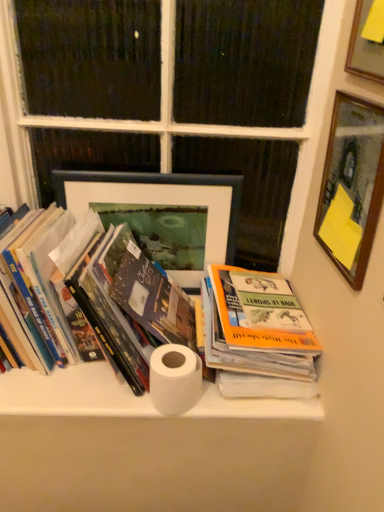
Question: Considering the relative positions of white matte toilet paper at center and hardcover book at left, which ranks as the first book in left-to-right order, in the image provided, is white matte toilet paper at center to the left or to the right of hardcover book at left, which ranks as the first book in left-to-right order,?

Choices:
 (A) left
 (B) right

Answer: (B)

Question: Does point (158, 378) appear closer or farther from the camera than point (127, 346)?

Choices:
 (A) farther
 (B) closer

Answer: (B)

Question: Which of these objects is positioned closest to the matte black picture frame at center, the first picture frame in the left-to-right sequence?

Choices:
 (A) wooden picture frame at upper right, acting as the second picture frame starting from the right
 (B) white painted wood at upper center
 (C) orange matte book at center, the first book positioned from the right
 (D) white paper towel at center
 (E) hardcover book at left, the second book from the right

Answer: (B)

Question: Which object is the closest to the hardcover book at left, the second book from the right?

Choices:
 (A) white painted wood at upper center
 (B) matte black picture frame at center, positioned as the 3th picture frame in front-to-back order
 (C) wooden frame at upper right, which is the 3th picture frame from back to front
 (D) white paper towel at center
 (E) orange matte book at center, the first book positioned from the right

Answer: (E)